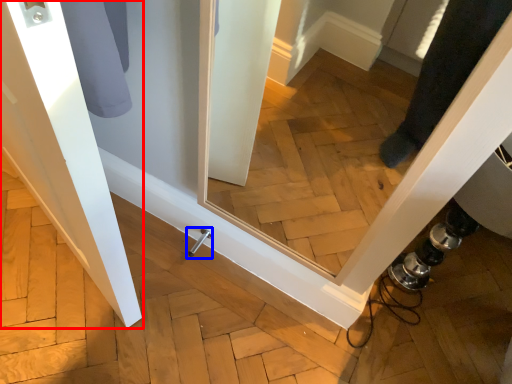
Question: Among these objects, which one is nearest to the camera, door (highlighted by a red box) or door handle (highlighted by a blue box)?

Choices:
 (A) door
 (B) door handle

Answer: (A)